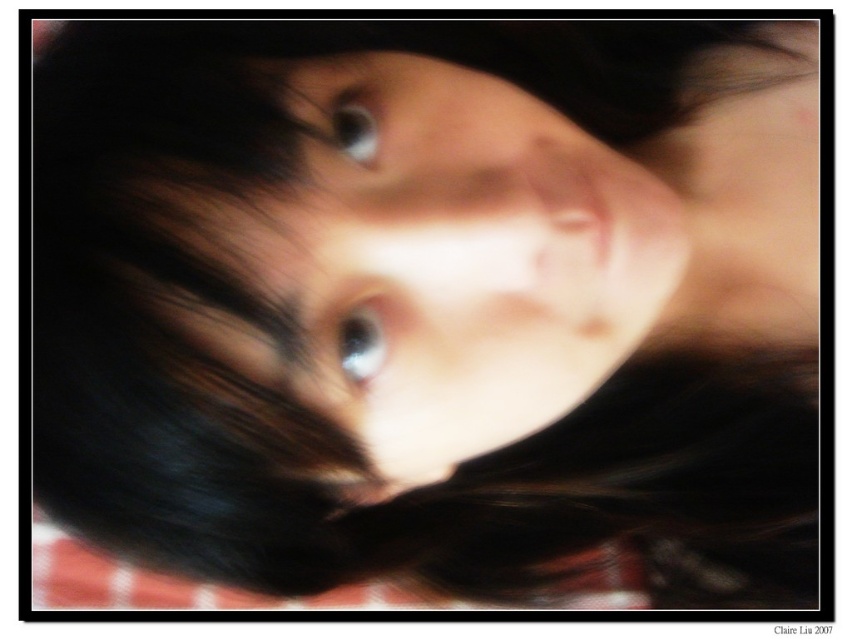
Is shiny blue eye at center smaller than blue glossy eye at center?

Indeed, shiny blue eye at center has a smaller size compared to blue glossy eye at center.

Looking at this image, which is above, shiny blue eye at center or blue glossy eye at center?

blue glossy eye at center is above.

Is point (373, 330) closer to camera compared to point (376, 150)?

That is True.

Find the location of a particular element. The image size is (852, 640). shiny blue eye at center is located at coordinates (361, 342).